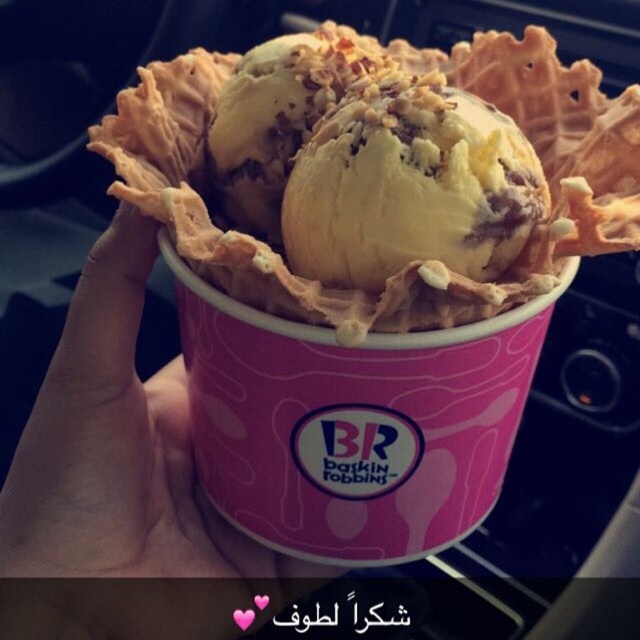
Question: Does yellow creamy ice cream at center appear on the left side of pink paper cup at center?

Choices:
 (A) yes
 (B) no

Answer: (B)

Question: Does yellow creamy ice cream at center appear on the left side of golden textured ice cream at center?

Choices:
 (A) no
 (B) yes

Answer: (B)

Question: Which point is farther to the camera?

Choices:
 (A) (285, 40)
 (B) (294, 577)

Answer: (B)

Question: Which object is positioned farthest from the pink paper cup at center?

Choices:
 (A) yellow creamy ice cream at center
 (B) golden textured ice cream at center

Answer: (B)

Question: Which point is closer to the camera?

Choices:
 (A) golden textured ice cream at center
 (B) pink paper cup at center
 (C) yellow creamy ice cream at center

Answer: (C)

Question: Does pink paper cup at center appear on the left side of golden textured ice cream at center?

Choices:
 (A) no
 (B) yes

Answer: (B)